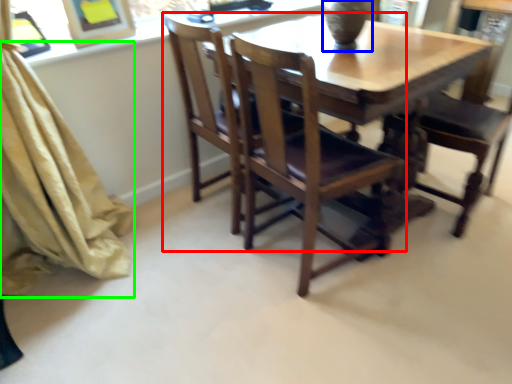
Question: Which object is positioned closest to chair (highlighted by a red box)? Select from glass vase (highlighted by a blue box) and curtain (highlighted by a green box).

Choices:
 (A) glass vase
 (B) curtain

Answer: (A)